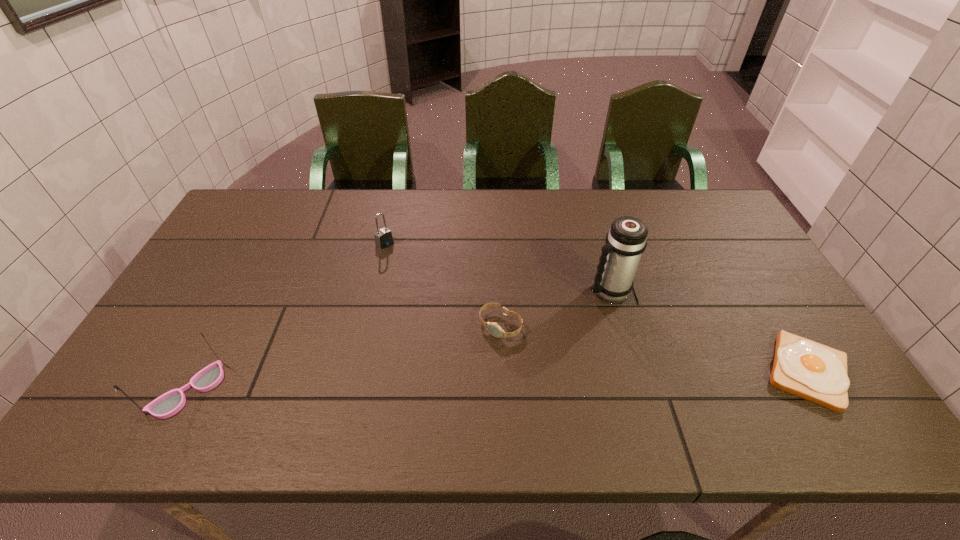
At what (x,y) coordinates should I click in order to perform the action: click on spectacles. Please return your answer as a coordinate pair (x, y). Looking at the image, I should click on (170, 403).

You are a GUI agent. You are given a task and a screenshot of the screen. Output one action in this format:
    pyautogui.click(x=<x>, y=<y>)
    Task: Click on the second tallest object
    
    Given the screenshot: What is the action you would take?
    pyautogui.click(x=170, y=403)

At what (x,y) coordinates should I click in order to perform the action: click on the rightmost object. Please return your answer as a coordinate pair (x, y). The image size is (960, 540). Looking at the image, I should click on (812, 371).

Find the location of a particular element. The width and height of the screenshot is (960, 540). the shortest object is located at coordinates (812, 371).

Find the location of a particular element. the third shortest object is located at coordinates (383, 237).

Where is `the farthest object`? This screenshot has height=540, width=960. the farthest object is located at coordinates (383, 237).

Identify the location of the tallest object. (626, 240).

You are a GUI agent. You are given a task and a screenshot of the screen. Output one action in this format:
    pyautogui.click(x=<x>, y=<y>)
    Task: Click on the second farthest object
    This screenshot has width=960, height=540.
    Given the screenshot: What is the action you would take?
    pyautogui.click(x=626, y=240)

Find the location of a particular element. The height and width of the screenshot is (540, 960). the fourth tallest object is located at coordinates (494, 329).

I want to click on the third object from left to right, so pyautogui.click(x=494, y=329).